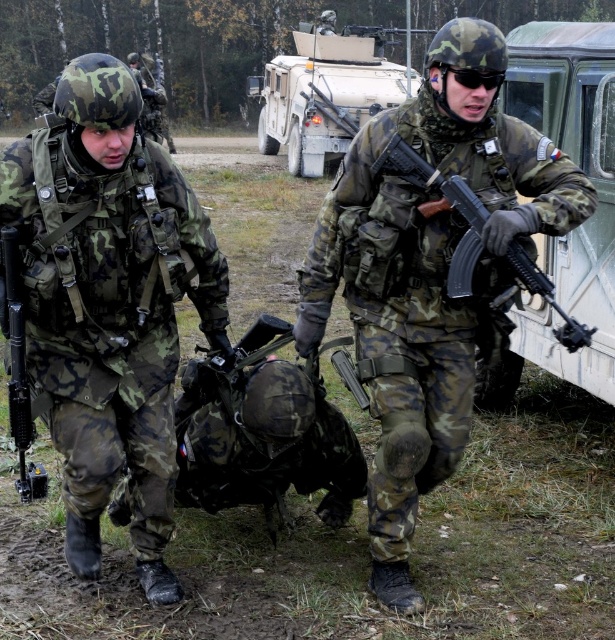
You are a military observer analyzing the positions of the soldiers in the image. Which soldier, the camouflage uniform at center or the matte black rifle at left, is located more to the right side of the image?

The camouflage uniform at center is positioned on the right side of the matte black rifle at left, so the camouflage uniform at center is located more to the right side of the image.

From the picture: You are a drone operator controlling a drone that is 1.5 meters above the ground. You need to hover the drone at the point labeled point [117,250]. Is the drone able to hover at that point without hitting the ground?

The point labeled point [117,250] is 3.08 meters from the camera, so the drone can hover there safely as it is higher than the drone.

You are a military observer in the field. You notice a camouflage uniform at center and a green matte truck at right. Which object is positioned closer to the left side of the scene?

The camouflage uniform at center is positioned to the left of the green matte truck at right, so the camouflage uniform at center is closer to the left side of the scene.